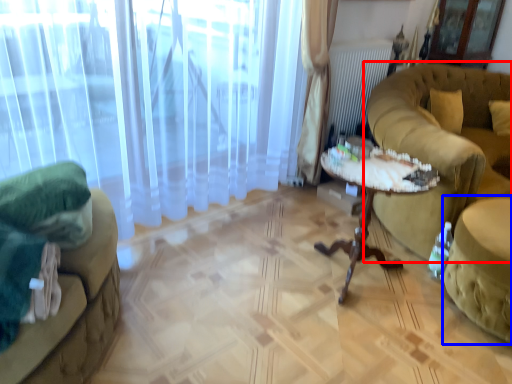
Question: Among these objects, which one is farthest to the camera, studio couch (highlighted by a red box) or swivel chair (highlighted by a blue box)?

Choices:
 (A) studio couch
 (B) swivel chair

Answer: (A)